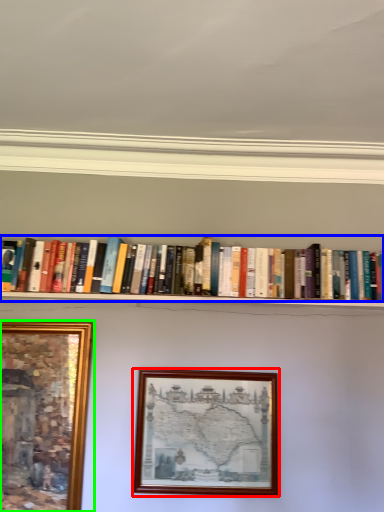
Question: Estimate the real-world distances between objects in this image. Which object is closer to picture frame (highlighted by a red box), book (highlighted by a blue box) or picture frame (highlighted by a green box)?

Choices:
 (A) book
 (B) picture frame

Answer: (B)